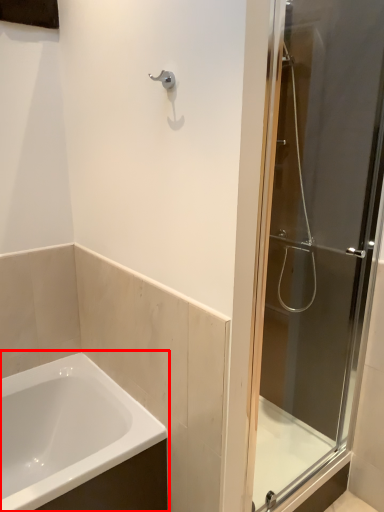
Question: From the image, what is the correct spatial relationship of bathtub (annotated by the red box) in relation to door?

Choices:
 (A) left
 (B) right

Answer: (A)